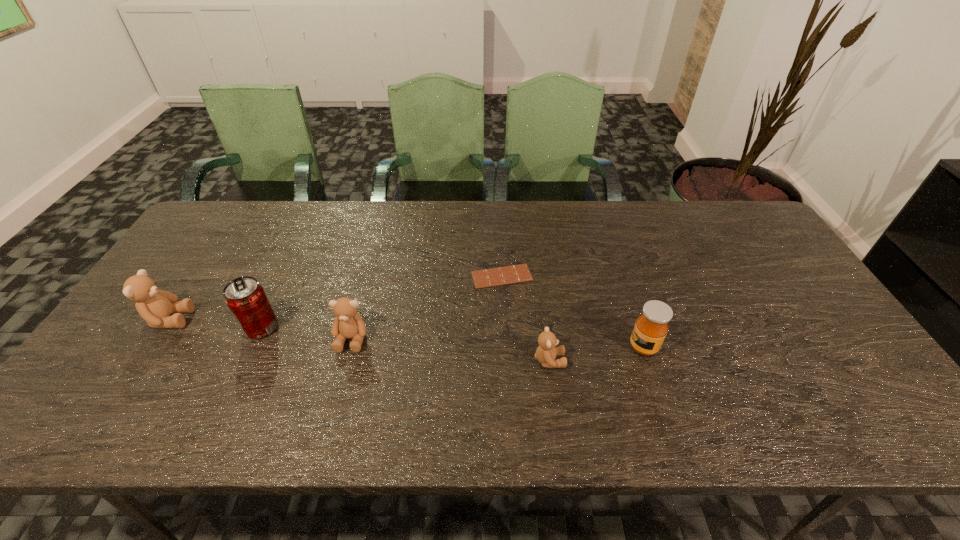
Identify the location of free space at the far edge. The width and height of the screenshot is (960, 540). tap(505, 211).

This screenshot has height=540, width=960. Identify the location of vacant space at the near edge. (636, 369).

In the image, there is a desktop. In order to click on vacant area at the left edge in this screenshot , I will do `click(159, 332)`.

At what (x,y) coordinates should I click in order to perform the action: click on free space at the right edge of the desktop. Please return your answer as a coordinate pair (x, y). The image size is (960, 540). Looking at the image, I should click on point(800,363).

Locate an element on the screen. The width and height of the screenshot is (960, 540). vacant space at the far right corner of the desktop is located at coordinates (721, 218).

This screenshot has width=960, height=540. What are the coordinates of `vacant area that lies between the fifth object from right to left and the tallest teddy bear` in the screenshot? It's located at (215, 323).

This screenshot has width=960, height=540. I want to click on empty location between the honey and the shortest object, so click(573, 312).

I want to click on empty space that is in between the leftmost teddy bear and the chocolate bar, so click(x=336, y=298).

This screenshot has width=960, height=540. In order to click on unoccupied area between the farthest object and the fourth object from right to left in this screenshot , I will do `click(426, 307)`.

The width and height of the screenshot is (960, 540). What are the coordinates of `free space between the chocolate bar and the second shortest teddy bear` in the screenshot? It's located at (426, 307).